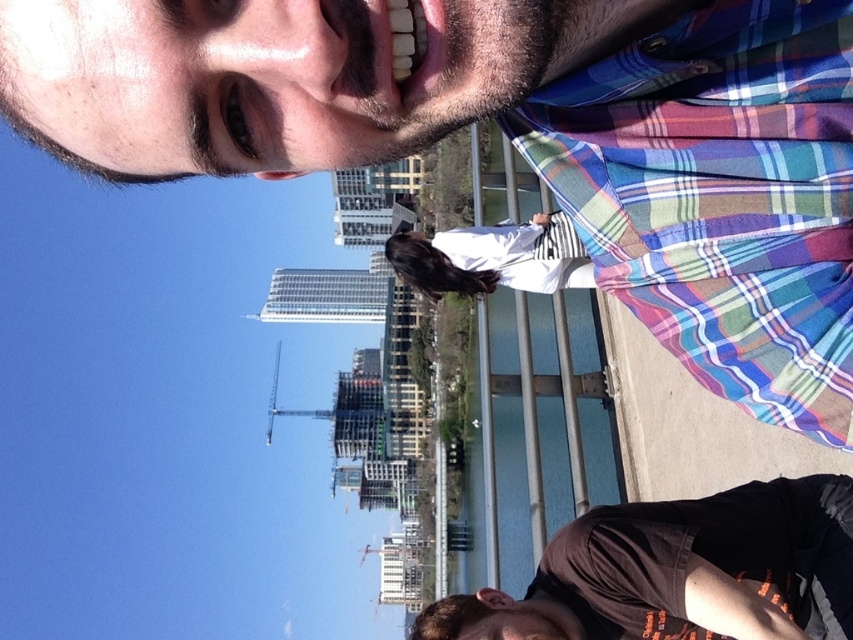
Question: Is brown cotton shirt at lower right closer to the viewer compared to white cotton shirt at center?

Choices:
 (A) yes
 (B) no

Answer: (A)

Question: Which object is farther from the camera taking this photo?

Choices:
 (A) multicolored plaid shirt at upper right
 (B) white cotton shirt at center

Answer: (B)

Question: Where is brown cotton shirt at lower right located in relation to white cotton shirt at center in the image?

Choices:
 (A) right
 (B) left

Answer: (A)

Question: Among these objects, which one is nearest to the camera?

Choices:
 (A) multicolored plaid shirt at upper right
 (B) white cotton shirt at center
 (C) brown cotton shirt at lower right

Answer: (A)

Question: Considering the real-world distances, which object is farthest from the white cotton shirt at center?

Choices:
 (A) multicolored plaid shirt at upper right
 (B) brown cotton shirt at lower right

Answer: (A)

Question: Is multicolored plaid shirt at upper right to the left of white cotton shirt at center from the viewer's perspective?

Choices:
 (A) no
 (B) yes

Answer: (A)